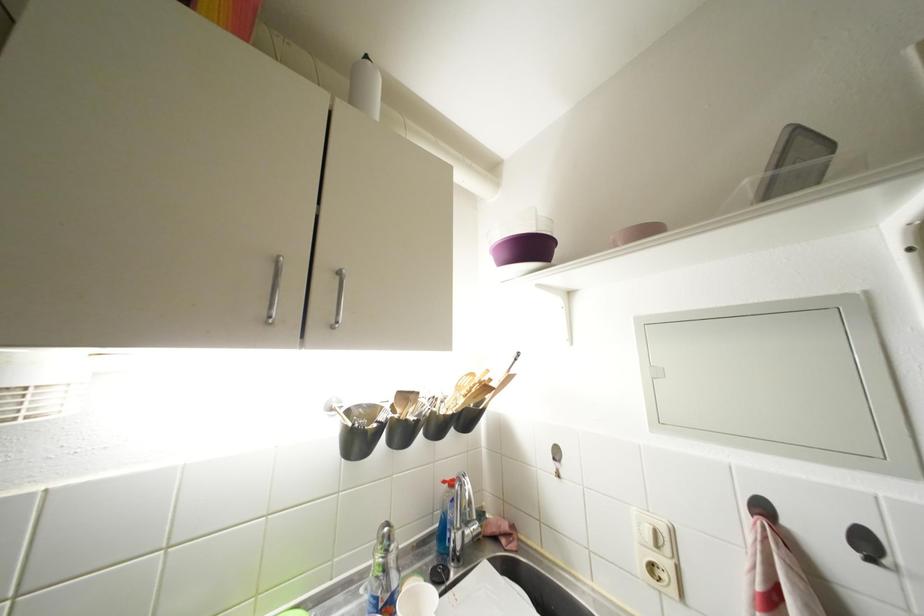
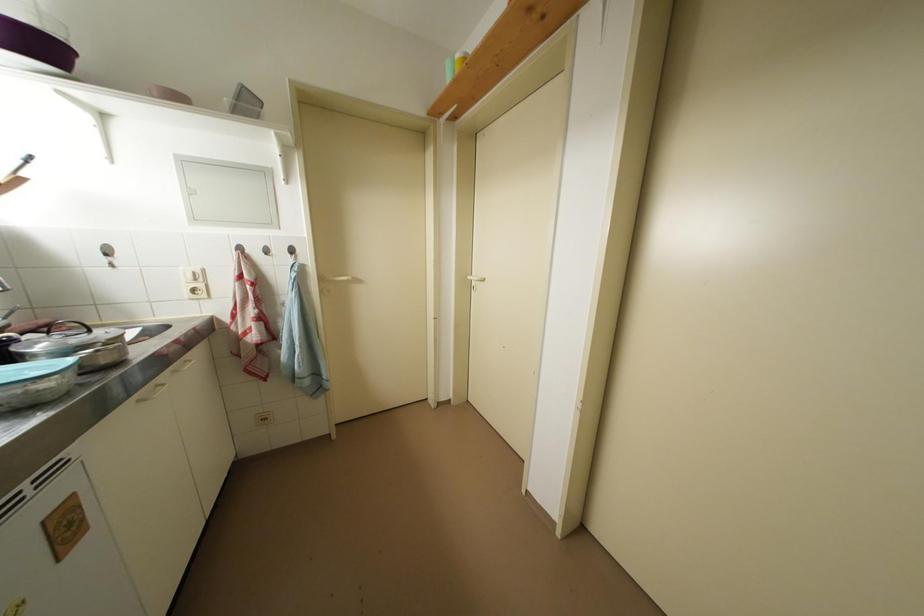
Where in the second image is the point corresponding to point 520,359 from the first image?

(30, 160)